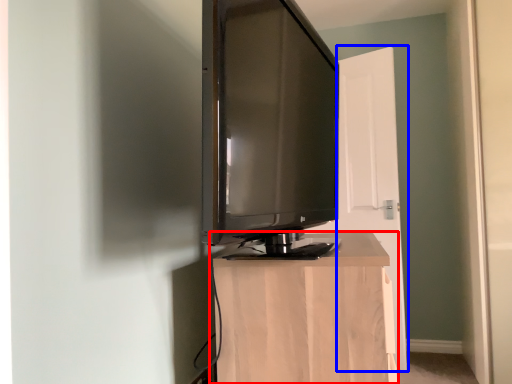
Question: Among these objects, which one is farthest to the camera, furniture (highlighted by a red box) or door (highlighted by a blue box)?

Choices:
 (A) furniture
 (B) door

Answer: (B)